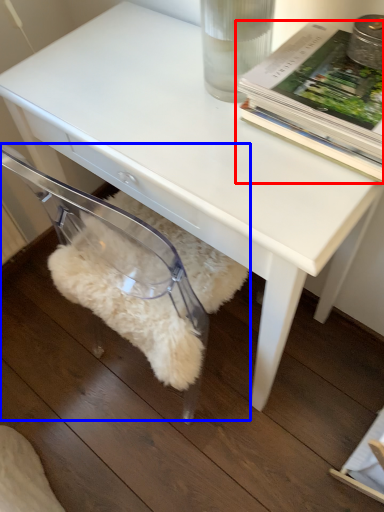
Question: Which point is closer to the camera, book (highlighted by a red box) or swivel chair (highlighted by a blue box)?

Choices:
 (A) book
 (B) swivel chair

Answer: (A)